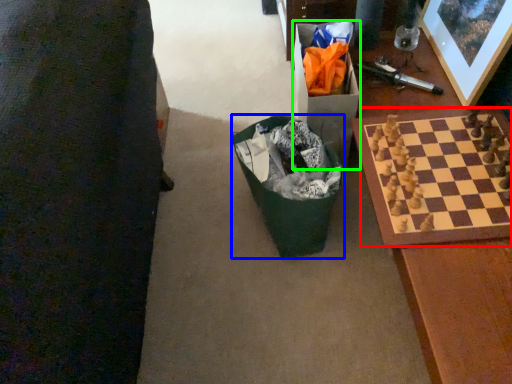
Question: Which object is positioned closest to board game (highlighted by a red box)? Select from recycling bin (highlighted by a blue box) and cardboard box (highlighted by a green box).

Choices:
 (A) recycling bin
 (B) cardboard box

Answer: (B)